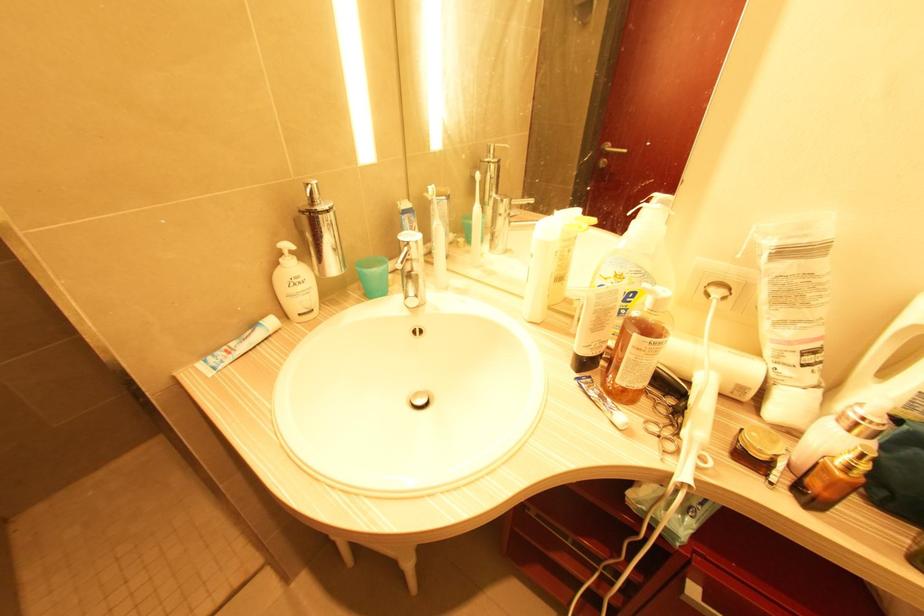
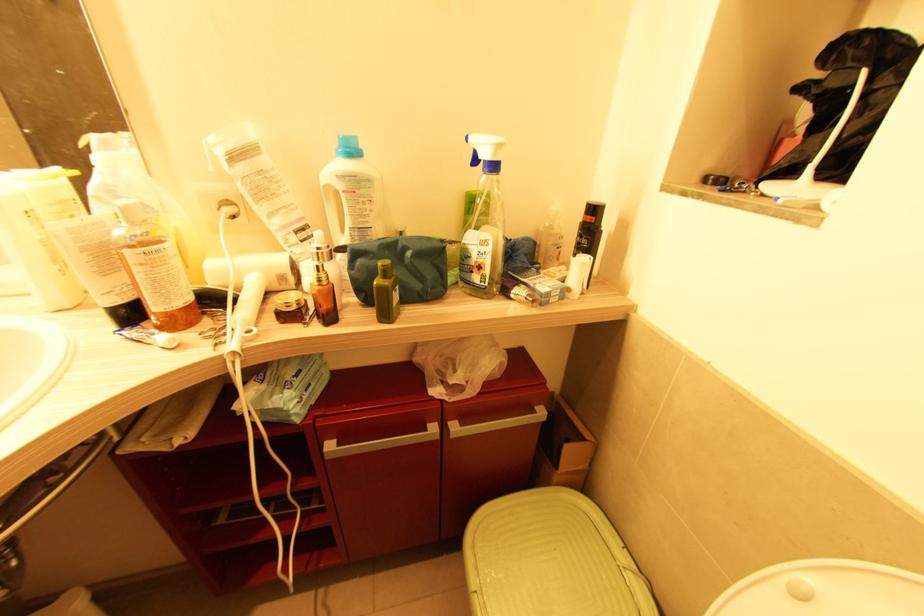
Where in the second image is the point corresponding to point (718, 293) from the first image?

(229, 211)